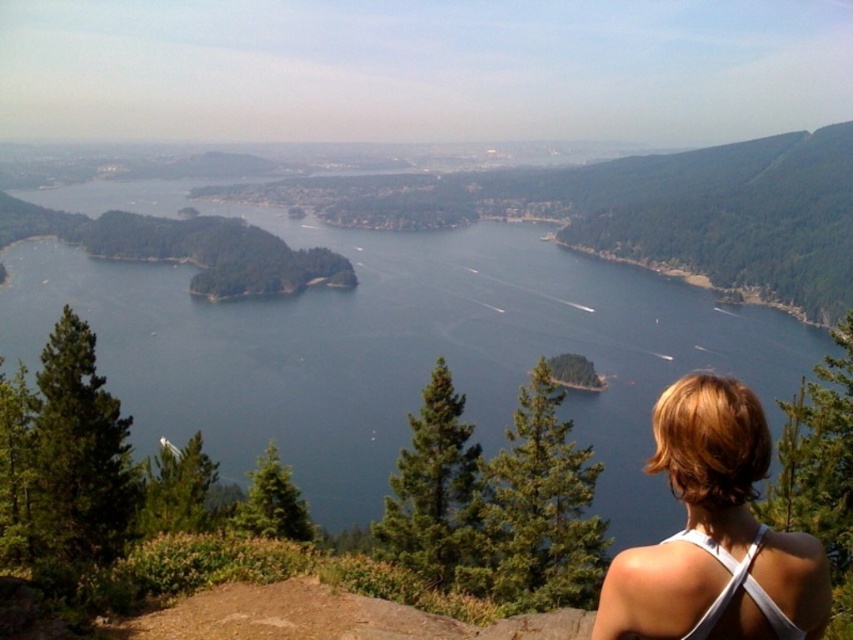
Question: Does blue water at center appear on the right side of white fabric at center?

Choices:
 (A) yes
 (B) no

Answer: (B)

Question: Is blue water at center smaller than white fabric at center?

Choices:
 (A) yes
 (B) no

Answer: (B)

Question: Which object appears farthest from the camera in this image?

Choices:
 (A) blue water at center
 (B) white fabric at center

Answer: (A)

Question: Which object is closer to the camera taking this photo?

Choices:
 (A) blue water at center
 (B) white fabric at center

Answer: (B)

Question: From the image, what is the correct spatial relationship of blue water at center in relation to white fabric at center?

Choices:
 (A) below
 (B) above

Answer: (B)